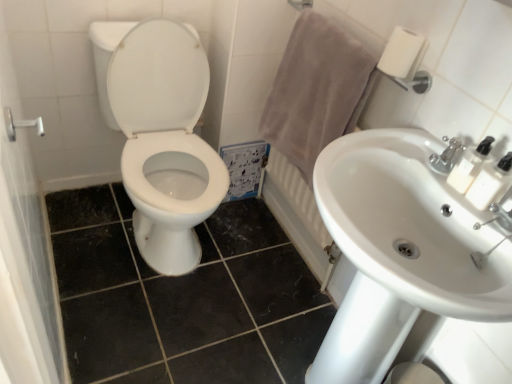
Question: Is beige cotton towel at upper right wider than satin nickel faucet at upper right?

Choices:
 (A) no
 (B) yes

Answer: (B)

Question: Is beige cotton towel at upper right positioned before satin nickel faucet at upper right?

Choices:
 (A) no
 (B) yes

Answer: (A)

Question: From a real-world perspective, is beige cotton towel at upper right beneath satin nickel faucet at upper right?

Choices:
 (A) no
 (B) yes

Answer: (B)

Question: Is beige cotton towel at upper right not near satin nickel faucet at upper right?

Choices:
 (A) yes
 (B) no

Answer: (B)

Question: Does beige cotton towel at upper right appear on the left side of satin nickel faucet at upper right?

Choices:
 (A) no
 (B) yes

Answer: (B)

Question: Is beige cotton towel at upper right oriented away from satin nickel faucet at upper right?

Choices:
 (A) no
 (B) yes

Answer: (A)

Question: From a real-world perspective, is white glossy sink at center right positioned over satin nickel faucet at upper right based on gravity?

Choices:
 (A) no
 (B) yes

Answer: (A)

Question: Can you confirm if white glossy sink at center right is taller than satin nickel faucet at upper right?

Choices:
 (A) yes
 (B) no

Answer: (A)

Question: Is white glossy sink at center right far from satin nickel faucet at upper right?

Choices:
 (A) no
 (B) yes

Answer: (A)

Question: Is white glossy sink at center right shorter than satin nickel faucet at upper right?

Choices:
 (A) no
 (B) yes

Answer: (A)

Question: Does white glossy sink at center right have a larger size compared to satin nickel faucet at upper right?

Choices:
 (A) no
 (B) yes

Answer: (B)

Question: From the image's perspective, is white glossy sink at center right located beneath satin nickel faucet at upper right?

Choices:
 (A) no
 (B) yes

Answer: (B)

Question: Considering the relative sizes of brushed metal shower handle at left and white ceramic faucet at upper right in the image provided, is brushed metal shower handle at left bigger than white ceramic faucet at upper right?

Choices:
 (A) no
 (B) yes

Answer: (A)